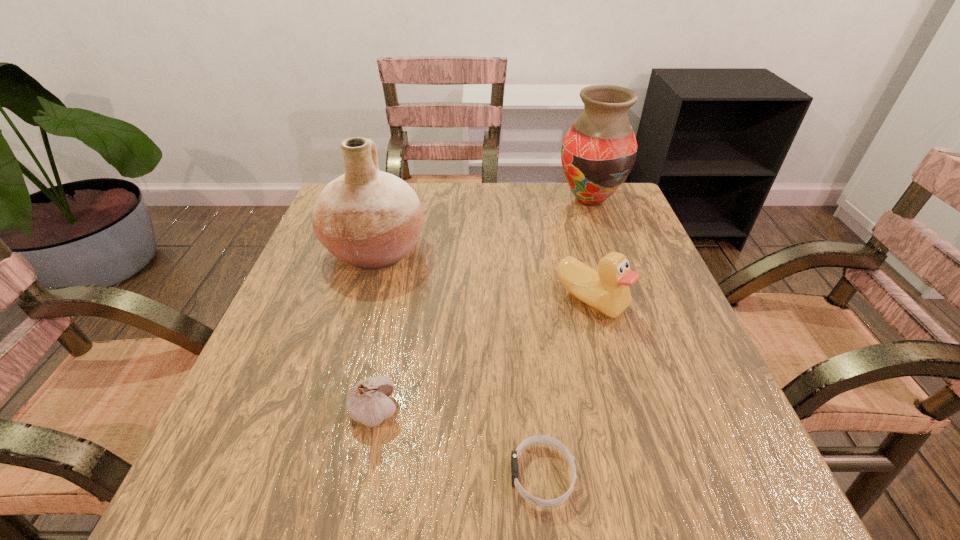
You are a GUI agent. You are given a task and a screenshot of the screen. Output one action in this format:
    pyautogui.click(x=<x>, y=<y>)
    Task: Click on the object that is at the far left corner
    The height and width of the screenshot is (540, 960).
    Given the screenshot: What is the action you would take?
    pyautogui.click(x=370, y=219)

Find the location of a particular element. This screenshot has height=540, width=960. object located at the far right corner is located at coordinates (598, 152).

The height and width of the screenshot is (540, 960). In order to click on free point at the far edge in this screenshot , I will do [x=510, y=211].

Where is `vacant space at the near edge`? vacant space at the near edge is located at coordinates (324, 460).

The width and height of the screenshot is (960, 540). I want to click on free space at the left edge of the desktop, so click(307, 248).

Where is `free space at the right edge of the desktop`? Image resolution: width=960 pixels, height=540 pixels. free space at the right edge of the desktop is located at coordinates (725, 397).

Locate an element on the screen. blank space at the near left corner of the desktop is located at coordinates (295, 478).

Find the location of `vacant region at the far right corner of the desktop`. vacant region at the far right corner of the desktop is located at coordinates coord(597,213).

Where is `vacant space that is in between the duck and the wristband`? This screenshot has width=960, height=540. vacant space that is in between the duck and the wristband is located at coordinates (567, 388).

This screenshot has width=960, height=540. What are the coordinates of `vacant area that lies between the wristband and the pottery` in the screenshot? It's located at tap(459, 363).